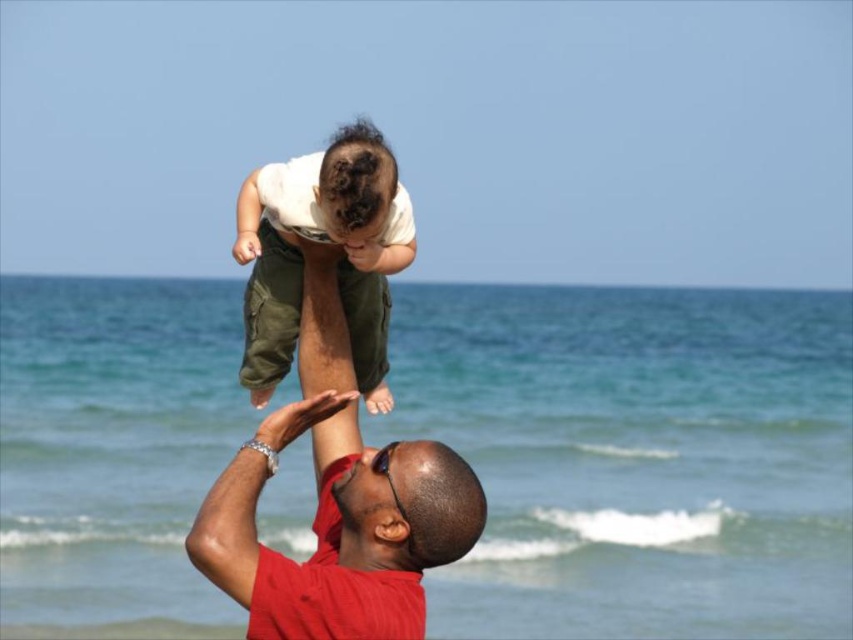
Question: Is matte red shirt at center bigger than shiny black sunglasses at center?

Choices:
 (A) yes
 (B) no

Answer: (A)

Question: Among these points, which one is nearest to the camera?

Choices:
 (A) (409, 516)
 (B) (335, 176)
 (C) (235, 221)
 (D) (410, 538)

Answer: (B)

Question: Which object is positioned farthest from the matte green cargo pants at center?

Choices:
 (A) dark brown hair at upper center
 (B) matte red shirt at center
 (C) shiny black sunglasses at center

Answer: (B)

Question: Does matte red shirt at center have a greater width compared to matte green cargo pants at center?

Choices:
 (A) no
 (B) yes

Answer: (A)

Question: Which point is closer to the camera taking this photo?

Choices:
 (A) (248, 484)
 (B) (364, 307)

Answer: (A)

Question: Does shiny black sunglasses at center lie in front of dark brown hair at upper center?

Choices:
 (A) no
 (B) yes

Answer: (A)